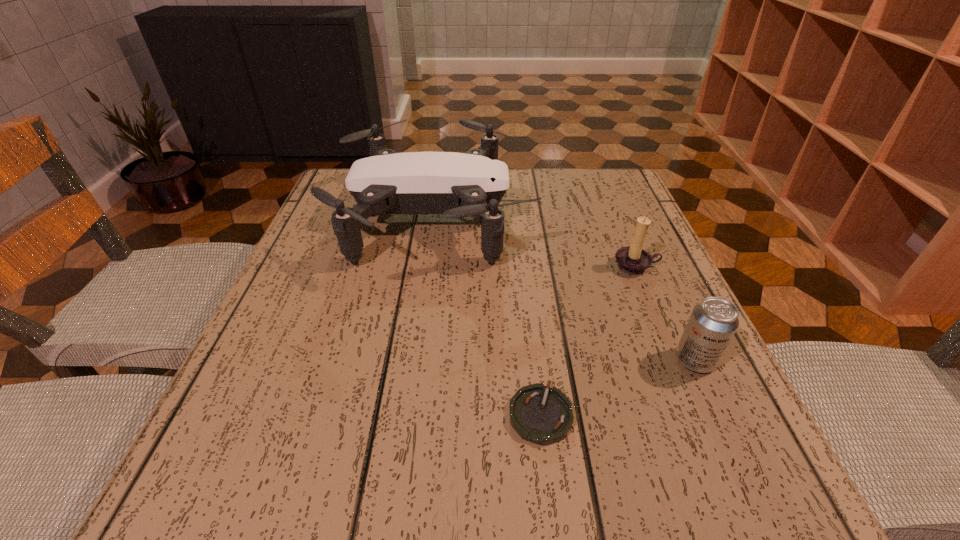
Find the location of a particular element. the tallest object is located at coordinates (456, 185).

At what (x,y) coordinates should I click in order to perform the action: click on candle holder. Please return your answer as a coordinate pair (x, y). Looking at the image, I should click on (633, 260).

Locate an element on the screen. beer can is located at coordinates (713, 322).

Where is `the nearest object`? the nearest object is located at coordinates (540, 414).

This screenshot has width=960, height=540. Find the location of `the shortest object`. the shortest object is located at coordinates [540, 414].

At what (x,y) coordinates should I click in order to perform the action: click on vacant space positioned 0.080m on the camera side of the tallest object. Please return your answer as a coordinate pair (x, y). The image size is (960, 540). Looking at the image, I should click on (564, 218).

I want to click on vacant space located 0.070m on the wick of the candle holder, so click(652, 303).

This screenshot has height=540, width=960. Find the location of `vacant region located 0.220m on the left of the second nearest object`. vacant region located 0.220m on the left of the second nearest object is located at coordinates (538, 360).

Locate an element on the screen. This screenshot has width=960, height=540. free space located on the right of the ashtray is located at coordinates (725, 414).

This screenshot has width=960, height=540. I want to click on object that is at the far edge, so click(456, 185).